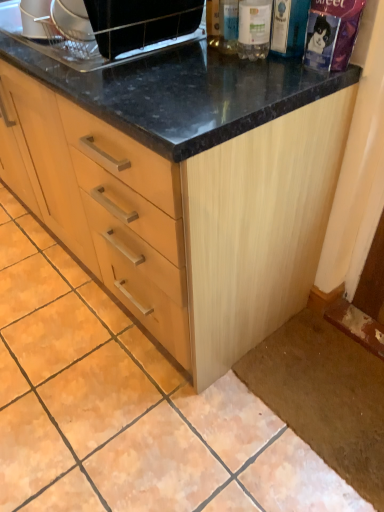
Question: Is clear plastic bottle at upper right, the second bottle when ordered from left to right, completely or partially outside of transparent plastic bottle at upper right, which is counted as the 1th bottle, starting from the right?

Choices:
 (A) no
 (B) yes

Answer: (B)

Question: From a real-world perspective, is clear plastic bottle at upper right, positioned as the second bottle in right-to-left order, located higher than transparent plastic bottle at upper right, acting as the third bottle starting from the left?

Choices:
 (A) no
 (B) yes

Answer: (B)

Question: Considering the relative sizes of clear plastic bottle at upper right, positioned as the second bottle in right-to-left order, and transparent plastic bottle at upper right, acting as the third bottle starting from the left, in the image provided, is clear plastic bottle at upper right, positioned as the second bottle in right-to-left order, bigger than transparent plastic bottle at upper right, acting as the third bottle starting from the left,?

Choices:
 (A) no
 (B) yes

Answer: (B)

Question: From the image's perspective, is clear plastic bottle at upper right, the second bottle when ordered from left to right, on top of transparent plastic bottle at upper right, acting as the third bottle starting from the left?

Choices:
 (A) no
 (B) yes

Answer: (B)

Question: Could you tell me if clear plastic bottle at upper right, positioned as the second bottle in right-to-left order, is facing transparent plastic bottle at upper right, which is counted as the 1th bottle, starting from the right?

Choices:
 (A) yes
 (B) no

Answer: (B)

Question: Is clear plastic bottle at upper right, the second bottle when ordered from left to right, inside the boundaries of transparent plastic bottle at upper right, acting as the third bottle starting from the left, or outside?

Choices:
 (A) outside
 (B) inside

Answer: (A)

Question: Considering their positions, is clear plastic bottle at upper right, positioned as the second bottle in right-to-left order, located in front of or behind transparent plastic bottle at upper right, acting as the third bottle starting from the left?

Choices:
 (A) front
 (B) behind

Answer: (A)

Question: From the image's perspective, is clear plastic bottle at upper right, positioned as the second bottle in right-to-left order, located above or below transparent plastic bottle at upper right, which is counted as the 1th bottle, starting from the right?

Choices:
 (A) above
 (B) below

Answer: (A)

Question: From a real-world perspective, relative to transparent plastic bottle at upper right, which is counted as the 1th bottle, starting from the right, is clear plastic bottle at upper right, positioned as the second bottle in right-to-left order, vertically above or below?

Choices:
 (A) above
 (B) below

Answer: (A)

Question: From the image's perspective, is clear glass bottle at upper center, the 1th bottle from the left, positioned above or below transparent plastic bottle at upper right, which is counted as the 1th bottle, starting from the right?

Choices:
 (A) below
 (B) above

Answer: (B)

Question: Considering the positions of clear glass bottle at upper center, arranged as the 3th bottle when viewed from the right, and transparent plastic bottle at upper right, which is counted as the 1th bottle, starting from the right, in the image, is clear glass bottle at upper center, arranged as the 3th bottle when viewed from the right, bigger or smaller than transparent plastic bottle at upper right, which is counted as the 1th bottle, starting from the right,?

Choices:
 (A) small
 (B) big

Answer: (B)

Question: Does point (216, 42) appear closer or farther from the camera than point (271, 15)?

Choices:
 (A) closer
 (B) farther

Answer: (B)

Question: In terms of height, does clear glass bottle at upper center, arranged as the 3th bottle when viewed from the right, look taller or shorter compared to transparent plastic bottle at upper right, which is counted as the 1th bottle, starting from the right?

Choices:
 (A) tall
 (B) short

Answer: (A)

Question: Is black glossy microwave at upper center spatially inside clear glass bottle at upper center, arranged as the 3th bottle when viewed from the right, or outside of it?

Choices:
 (A) outside
 (B) inside

Answer: (A)

Question: Does point (107, 33) appear closer or farther from the camera than point (211, 10)?

Choices:
 (A) farther
 (B) closer

Answer: (B)